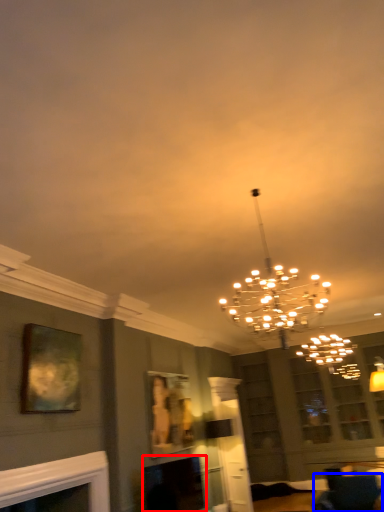
Question: Which of the following is the closest to the observer, fireplace (highlighted by a red box) or furniture (highlighted by a blue box)?

Choices:
 (A) fireplace
 (B) furniture

Answer: (B)